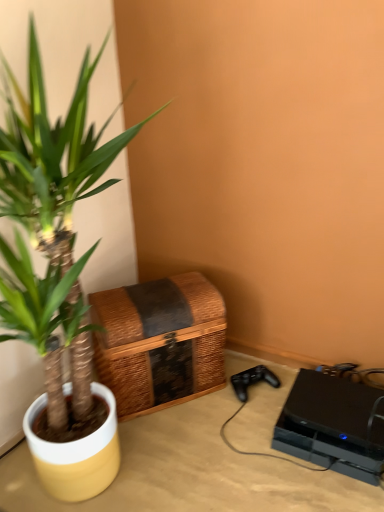
This screenshot has width=384, height=512. Identify the location of vacant region above beige wood table at lower right (from a real-world perspective). (226, 432).